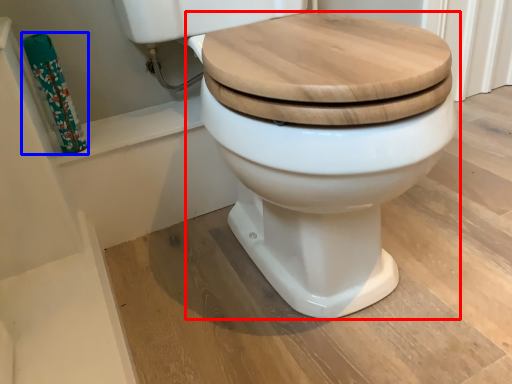
Question: Among these objects, which one is farthest to the camera, toilet (highlighted by a red box) or toilet paper (highlighted by a blue box)?

Choices:
 (A) toilet
 (B) toilet paper

Answer: (B)